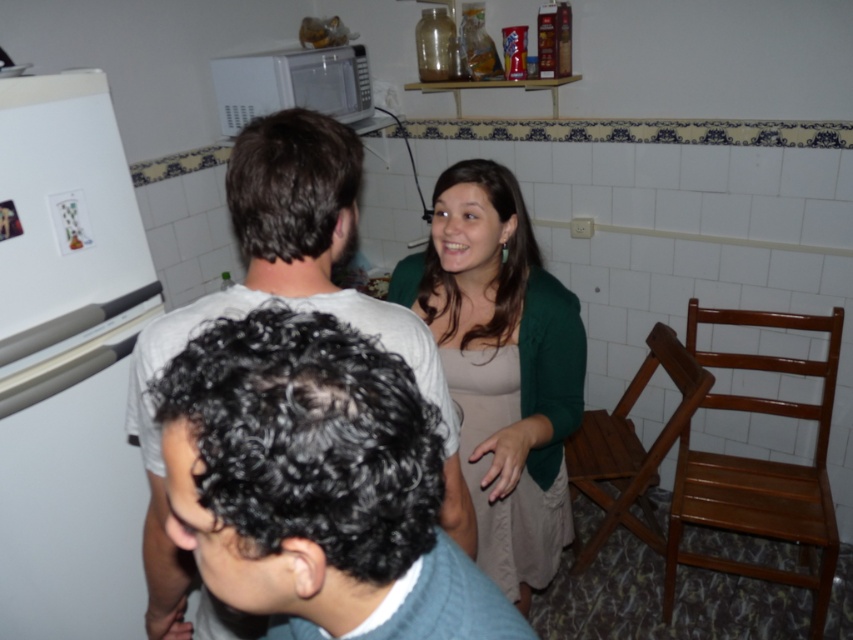
Based on the scene described, which object has a greater width when comparing the dark brown hair at center and the white matte microwave at upper center?

The dark brown hair at center has a greater width than the white matte microwave at upper center according to the description.

You are standing in the kitchen and want to place a new magnet on the white matte refrigerator at left. If the refrigerator is at coordinates approximately 0.569 on the x axis and 0.081 on the y axis, where would you place the magnet to ensure it stays centered vertically?

→ To center the magnet vertically on the white matte refrigerator at left, place it near the y coordinate of 0.081 since that is the refrigerator center point as per its position at point (68,364).

You are a photographer standing 34.44 inches away from the dark brown hair at center. Can you capture the entire scene in one shot without moving?

The dark brown hair at center and camera are 34.44 inches apart, so if the photographer is exactly at that distance, they can capture the entire scene in one shot without needing to move.